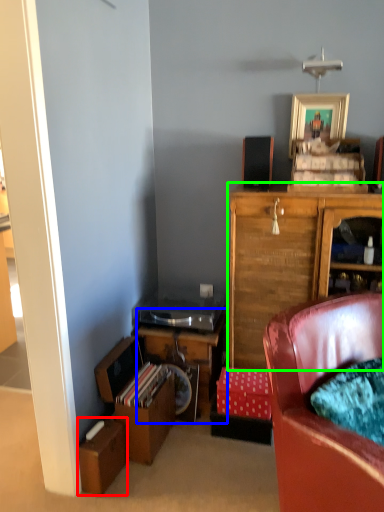
Question: Considering the real-world distances, which object is farthest from cardboard box (highlighted by a red box)? desk (highlighted by a blue box) or cabinetry (highlighted by a green box)?

Choices:
 (A) desk
 (B) cabinetry

Answer: (B)